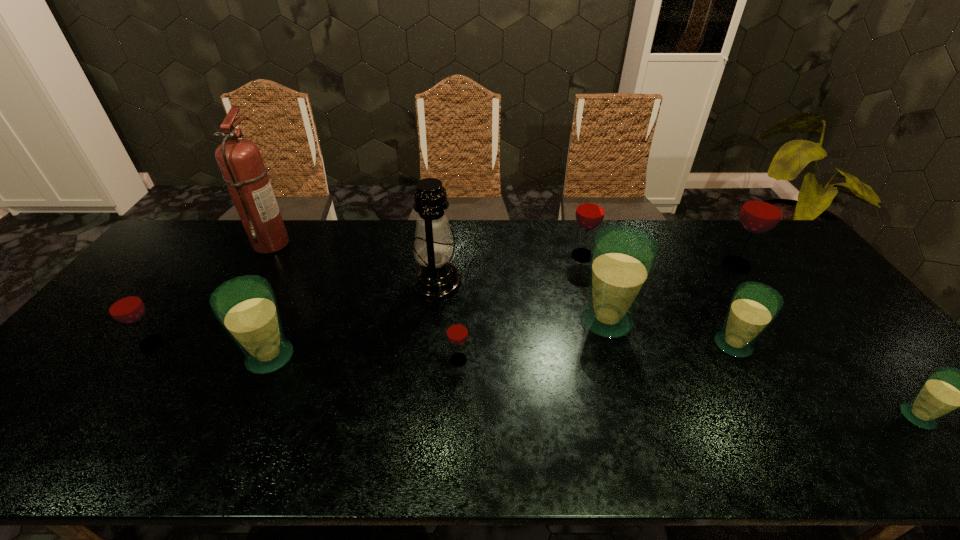
Identify the location of the second closest red glass to the rightmost red glass. click(x=457, y=331).

You are a GUI agent. You are given a task and a screenshot of the screen. Output one action in this format:
    pyautogui.click(x=<x>, y=<y>)
    Task: Click on the red glass that is the closest to the smallest red glass
    The image size is (960, 540).
    Given the screenshot: What is the action you would take?
    pyautogui.click(x=590, y=211)

Where is `blue glass object that ranks as the third closest to the third smallest red glass`? blue glass object that ranks as the third closest to the third smallest red glass is located at coordinates (946, 389).

Identify which blue glass is the second closest to the second biggest red glass. Please provide its 2D coordinates. Your answer should be formatted as a tuple, i.e. [(x, y)], where the tuple contains the x and y coordinates of a point satisfying the conditions above.

[(754, 306)]

Locate an element on the screen. This screenshot has width=960, height=540. vacant region that satisfies the following two spatial constraints: 1. on the back side of the eighth object from left to right; 2. on the right side of the biggest red glass is located at coordinates (688, 265).

What are the coordinates of `free spot that satisfies the following two spatial constraints: 1. on the back side of the second smallest blue glass; 2. on the left side of the ninth object from left to right` in the screenshot? It's located at (688, 265).

The image size is (960, 540). What are the coordinates of `vacant space that satisfies the following two spatial constraints: 1. on the front side of the biggest blue glass; 2. on the left side of the second red glass from right to left` in the screenshot? It's located at (601, 321).

The width and height of the screenshot is (960, 540). Identify the location of vacant area that satisfies the following two spatial constraints: 1. on the back side of the black oil lamp; 2. on the right side of the leftmost object. pyautogui.click(x=196, y=283).